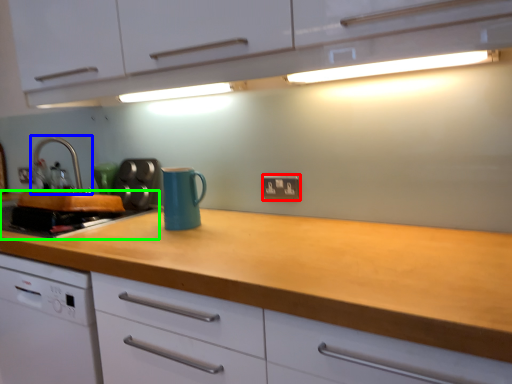
Question: Estimate the real-world distances between objects in this image. Which object is farther from electric outlet (highlighted by a red box), tap (highlighted by a blue box) or kitchen appliance (highlighted by a green box)?

Choices:
 (A) tap
 (B) kitchen appliance

Answer: (A)